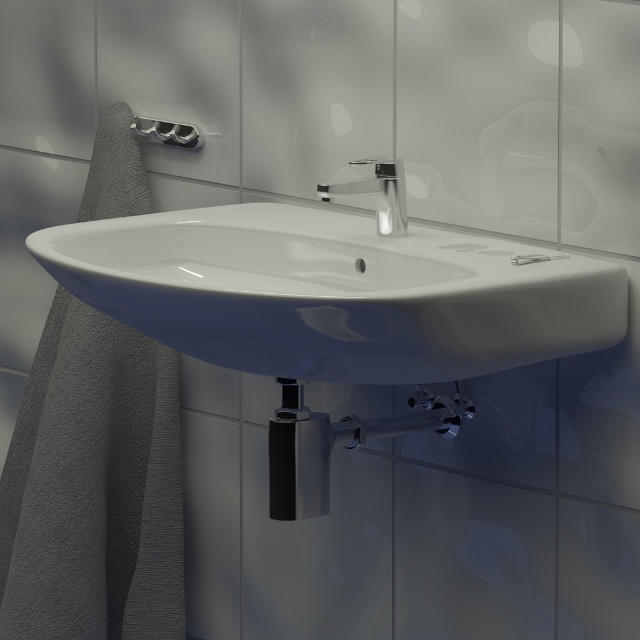
Who is higher up, white glossy sink at center or brushed metal towel bar at upper left?

Positioned higher is brushed metal towel bar at upper left.

Between white glossy sink at center and brushed metal towel bar at upper left, which one is positioned lower?

Positioned lower is white glossy sink at center.

Find the location of a particular element. white glossy sink at center is located at coordinates (336, 292).

You are a GUI agent. You are given a task and a screenshot of the screen. Output one action in this format:
    pyautogui.click(x=<x>, y=<y>)
    Task: Click on the white glossy sink at center
    
    Given the screenshot: What is the action you would take?
    pyautogui.click(x=336, y=292)

How far apart are white glossy sink at center and polished chrome faucet at center?

The distance of white glossy sink at center from polished chrome faucet at center is 9.78 inches.

Is white glossy sink at center behind polished chrome faucet at center?

No, it is not.

Is point (456, 288) closer to camera compared to point (397, 234)?

Yes, point (456, 288) is in front of point (397, 234).

Locate an element on the screen. The image size is (640, 640). white glossy sink at center is located at coordinates (336, 292).

Is polished chrome faucet at center to the right of brushed metal towel bar at upper left from the viewer's perspective?

Yes, polished chrome faucet at center is to the right of brushed metal towel bar at upper left.

Is point (320, 186) positioned after point (184, 132)?

No, (320, 186) is in front of (184, 132).

Find the location of a particular element. The height and width of the screenshot is (640, 640). polished chrome faucet at center is located at coordinates (378, 193).